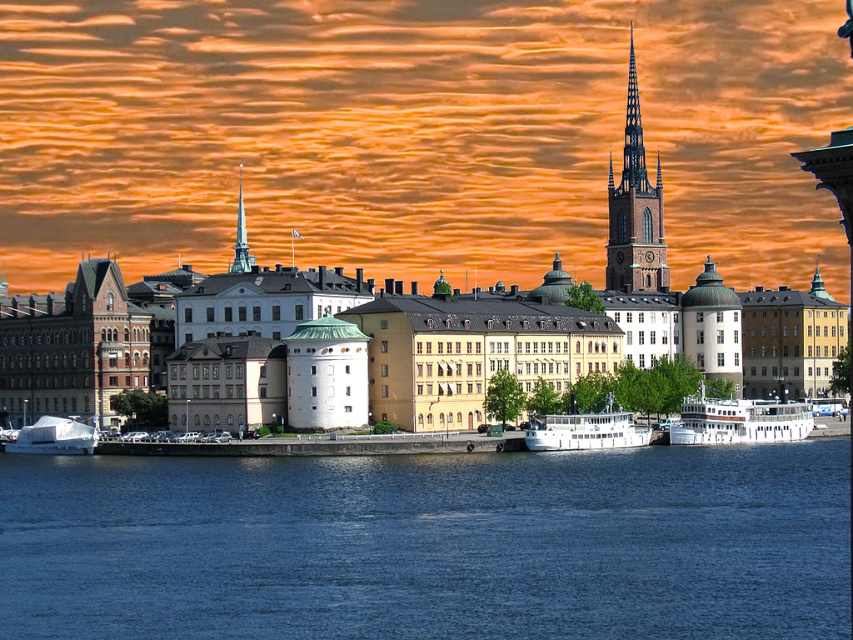
You are standing at the waterfront and want to take a photo of the blue water at center and the white matte boat at lower left. Based on their positions, which object should appear larger in your photo?

The blue water at center appears larger in the photo because it is closer to the viewer compared to the white matte boat at lower left.

You are standing at the waterfront and want to take a photo that includes both the point at coordinates point (422, 492) and point (631, 244). Which point will appear larger in your photo?

Point (422, 492) is closer to the camera than point (631, 244), so it will appear larger in the photo.

You are a tourist standing at the waterfront and want to take a photo that includes both the blue water at center and the brown stone spire at upper right. Given that your camera has a maximum zoom range of 100 feet, can you capture both objects in a single frame without moving your position?

The blue water at center and brown stone spire at upper right are 226.64 feet apart. Since the maximum zoom range of your camera is only 100 feet, you cannot capture both objects in a single frame without moving your position.